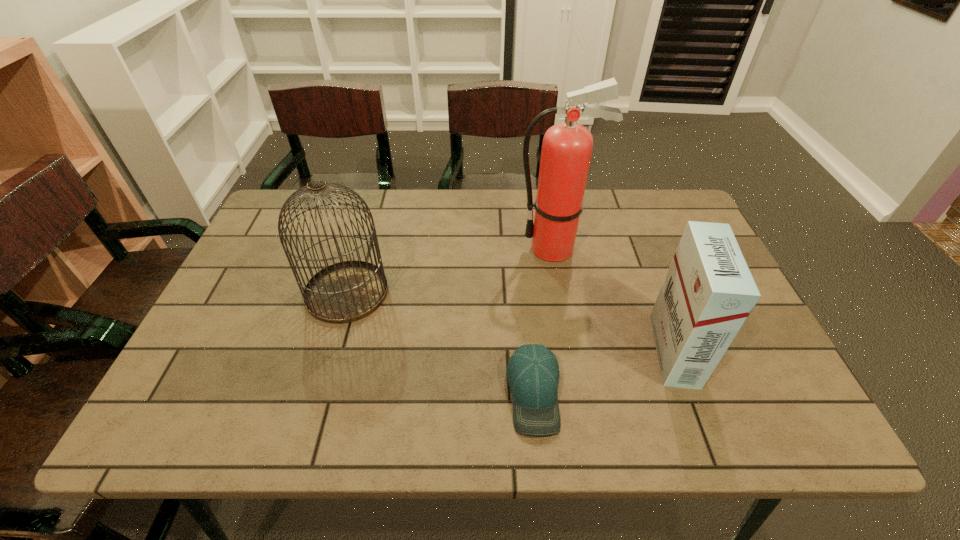
Locate an element on the screen. free spot between the rightmost object and the fire extinguisher is located at coordinates click(613, 299).

At what (x,y) coordinates should I click in order to perform the action: click on free spot between the leftmost object and the farthest object. Please return your answer as a coordinate pair (x, y). This screenshot has height=540, width=960. Looking at the image, I should click on (450, 271).

Identify the location of empty space that is in between the cigarette case and the baseball cap. (604, 372).

You are a GUI agent. You are given a task and a screenshot of the screen. Output one action in this format:
    pyautogui.click(x=<x>, y=<y>)
    Task: Click on the empty location between the baseball cap and the farthest object
    Image resolution: width=960 pixels, height=540 pixels.
    Given the screenshot: What is the action you would take?
    (x=544, y=321)

Locate an element on the screen. empty space between the rightmost object and the shortest object is located at coordinates (604, 372).

At what (x,y) coordinates should I click in order to perform the action: click on free space that is in between the rightmost object and the birdcage. Please return your answer as a coordinate pair (x, y). The width and height of the screenshot is (960, 540). Looking at the image, I should click on (511, 321).

Image resolution: width=960 pixels, height=540 pixels. Identify the location of free space between the baseball cap and the tallest object. (544, 321).

Find the location of a particular element. The image size is (960, 540). empty location between the baseball cap and the leftmost object is located at coordinates coord(441,342).

Where is `vacant space that's between the cigarette case and the birdcage`? The image size is (960, 540). vacant space that's between the cigarette case and the birdcage is located at coordinates (511, 321).

This screenshot has width=960, height=540. In order to click on object identified as the third closest to the fire extinguisher in this screenshot , I will do `click(347, 291)`.